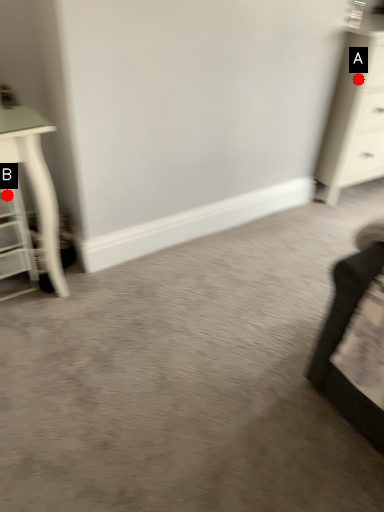
Question: Two points are circled on the image, labeled by A and B beside each circle. Which point appears closest to the camera in this image?

Choices:
 (A) A is closer
 (B) B is closer

Answer: (B)